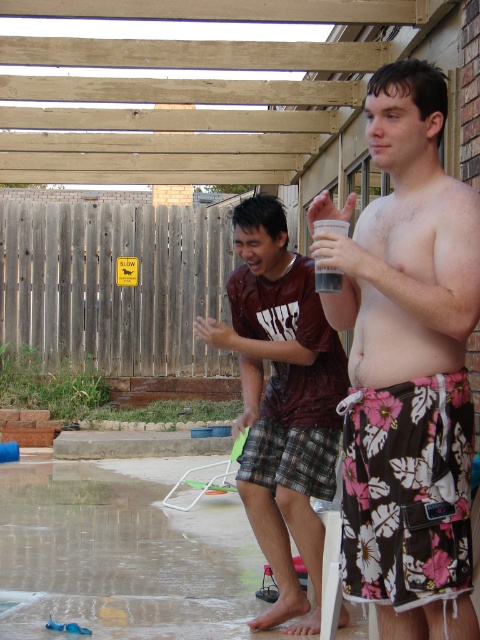
In the scene shown: Who is more distant from viewer, [374,588] or [416,260]?

The point [374,588] is more distant.

At what (x,y) coordinates should I click in order to perform the action: click on floral swim trunks at center. Please return your answer as a coordinate pair (x, y). This screenshot has height=640, width=480. Looking at the image, I should click on (408, 369).

Is point (351, 348) in front of point (314, 227)?

No, (351, 348) is behind (314, 227).

Image resolution: width=480 pixels, height=640 pixels. What do you see at coordinates (411, 282) in the screenshot?
I see `pink floral shorts at right` at bounding box center [411, 282].

This screenshot has width=480, height=640. In order to click on pink floral shorts at right in this screenshot , I will do `click(411, 282)`.

Measure the distance between floral swim trunks at center and transparent plastic cup at upper center.

floral swim trunks at center is 37.25 centimeters away from transparent plastic cup at upper center.

Between floral swim trunks at center and transparent plastic cup at upper center, which one appears on the right side from the viewer's perspective?

From the viewer's perspective, floral swim trunks at center appears more on the right side.

Image resolution: width=480 pixels, height=640 pixels. What do you see at coordinates (408, 369) in the screenshot? I see `floral swim trunks at center` at bounding box center [408, 369].

Locate an element on the screen. floral swim trunks at center is located at coordinates (408, 369).